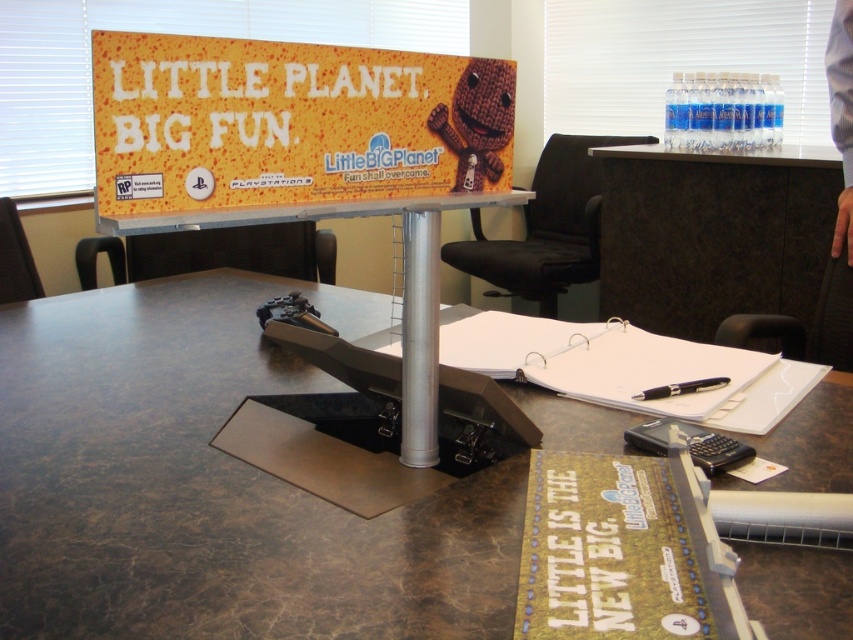
This screenshot has height=640, width=853. I want to click on orange fabric poster at upper center, so click(289, 129).

Which of these two, orange fabric poster at upper center or black plastic pen at center, stands shorter?

Standing shorter between the two is black plastic pen at center.

Which is behind, point (381, 138) or point (656, 390)?

The point (656, 390) is more distant.

Image resolution: width=853 pixels, height=640 pixels. Identify the location of orange fabric poster at upper center. (289, 129).

Is brown marble table at center shorter than orange fabric poster at upper center?

Incorrect, brown marble table at center's height does not fall short of orange fabric poster at upper center's.

Is brown marble table at center positioned behind orange fabric poster at upper center?

No.

Image resolution: width=853 pixels, height=640 pixels. What do you see at coordinates (212, 484) in the screenshot?
I see `brown marble table at center` at bounding box center [212, 484].

Identify the location of brown marble table at center. (212, 484).

Is brown marble table at center thinner than black plastic pen at center?

No.

Who is positioned more to the left, brown marble table at center or black plastic pen at center?

From the viewer's perspective, brown marble table at center appears more on the left side.

The width and height of the screenshot is (853, 640). What do you see at coordinates (212, 484) in the screenshot?
I see `brown marble table at center` at bounding box center [212, 484].

At what (x,y) coordinates should I click in order to perform the action: click on brown marble table at center. Please return your answer as a coordinate pair (x, y). This screenshot has width=853, height=640. Looking at the image, I should click on (212, 484).